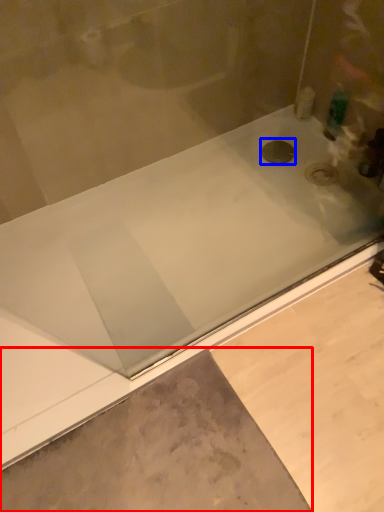
Question: Which object appears farthest to the camera in this image, concrete (highlighted by a red box) or drain (highlighted by a blue box)?

Choices:
 (A) concrete
 (B) drain

Answer: (B)